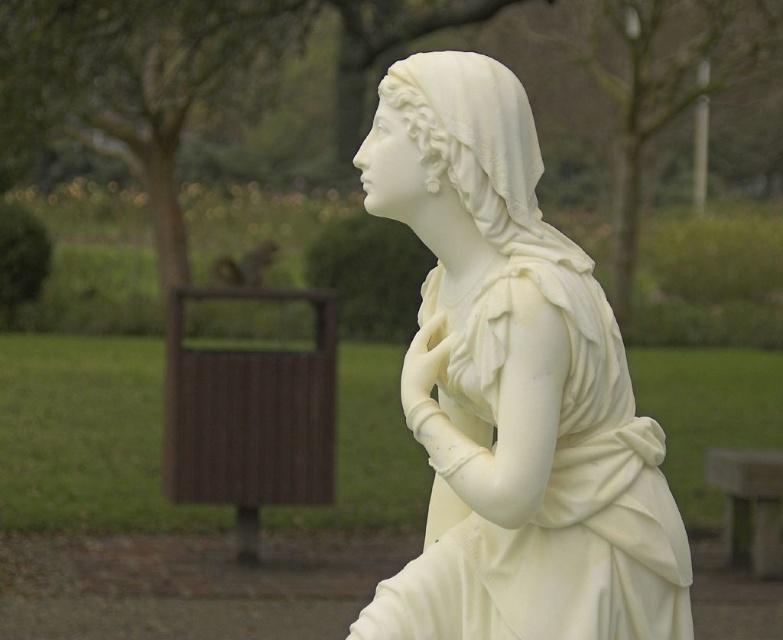
Question: Which point is farther to the camera?

Choices:
 (A) white marble statue at center
 (B) smooth gray stone bench at lower right

Answer: (B)

Question: Which object appears farthest from the camera in this image?

Choices:
 (A) smooth gray stone bench at lower right
 (B) white marble statue at center

Answer: (A)

Question: Does white marble statue at center appear under smooth gray stone bench at lower right?

Choices:
 (A) no
 (B) yes

Answer: (A)

Question: Does white marble statue at center appear over smooth gray stone bench at lower right?

Choices:
 (A) yes
 (B) no

Answer: (A)

Question: Can you confirm if white marble statue at center is positioned to the right of smooth gray stone bench at lower right?

Choices:
 (A) yes
 (B) no

Answer: (B)